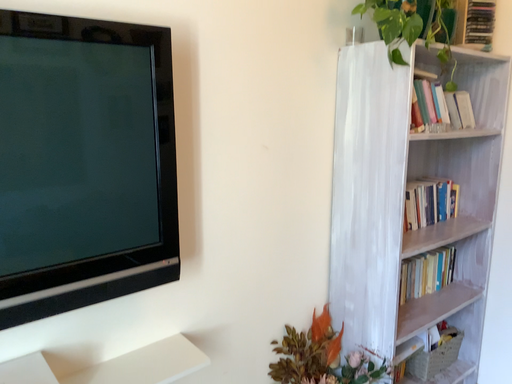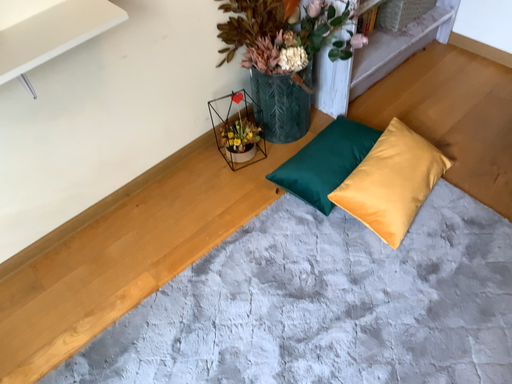
Question: How did the camera likely rotate when shooting the video?

Choices:
 (A) rotated upward
 (B) rotated downward

Answer: (B)